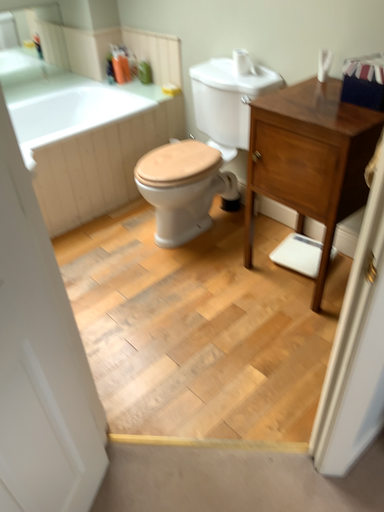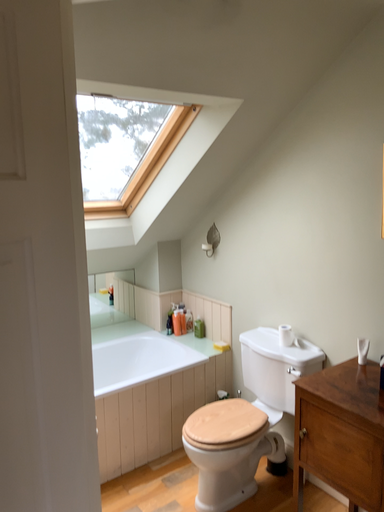
Question: How did the camera likely rotate when shooting the video?

Choices:
 (A) rotated downward
 (B) rotated upward

Answer: (B)